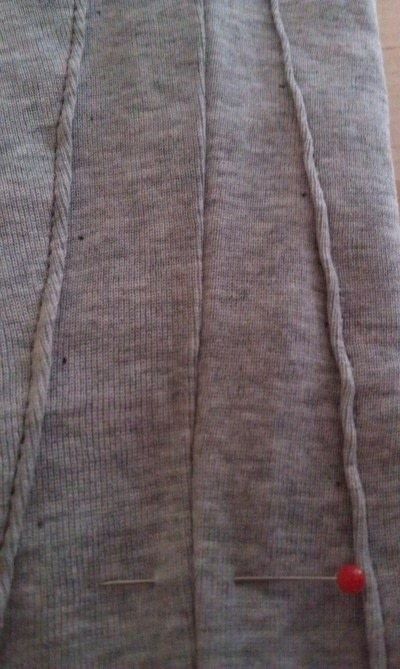
Identify the location of incomplete sewing project. (139, 336).